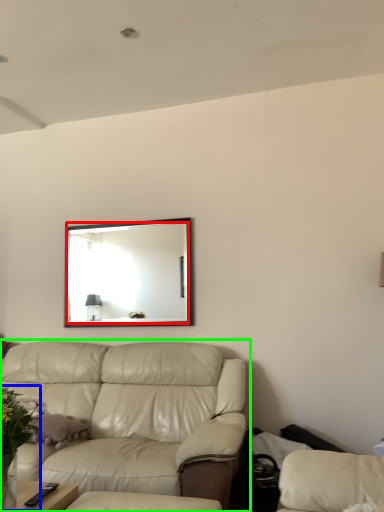
Question: Estimate the real-world distances between objects in this image. Which object is closer to mirror (highlighted by a red box), floral arrangement (highlighted by a blue box) or studio couch (highlighted by a green box)?

Choices:
 (A) floral arrangement
 (B) studio couch

Answer: (B)